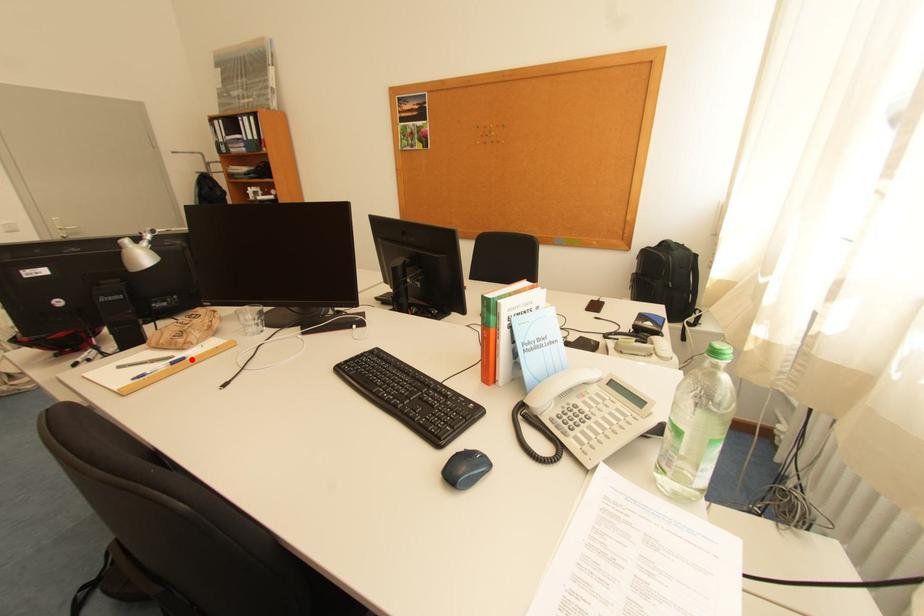
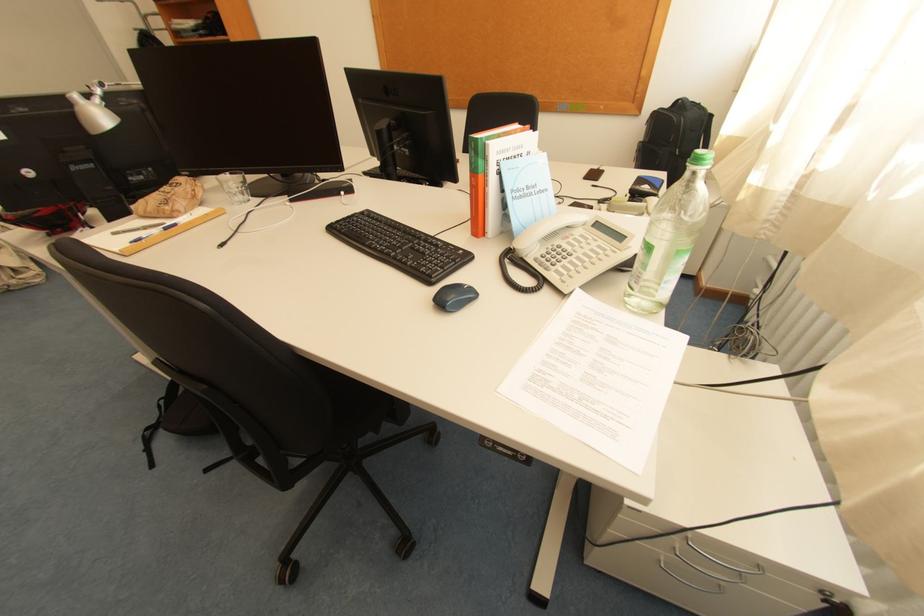
Find the pixel in the second image that matches the highlighted location in the first image.

(184, 225)